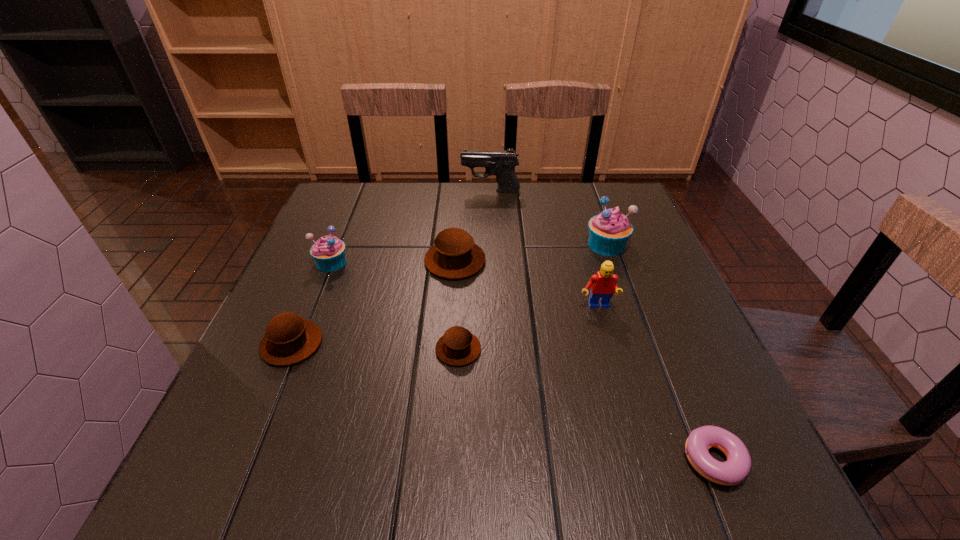
Locate which brown muffin ranks second in proximity to the third shortest object. Please provide its 2D coordinates. Your answer should be formatted as a tuple, i.e. [(x, y)], where the tuple contains the x and y coordinates of a point satisfying the conditions above.

[(458, 346)]

Where is `brown muffin that stands as the third closest to the smaller blue muffin`? Image resolution: width=960 pixels, height=540 pixels. brown muffin that stands as the third closest to the smaller blue muffin is located at coordinates (458, 346).

Find the location of `vacant space that satisfies the following two spatial constraints: 1. on the front side of the purple doughnut; 2. on the left side of the leftmost brown muffin`. vacant space that satisfies the following two spatial constraints: 1. on the front side of the purple doughnut; 2. on the left side of the leftmost brown muffin is located at coordinates (243, 461).

Locate an element on the screen. The width and height of the screenshot is (960, 540). vacant area in the image that satisfies the following two spatial constraints: 1. at the barrel of the farthest object; 2. on the back side of the bigger blue muffin is located at coordinates (492, 245).

The width and height of the screenshot is (960, 540). I want to click on vacant space that satisfies the following two spatial constraints: 1. on the back side of the biggest brown muffin; 2. on the left side of the left blue muffin, so click(332, 261).

Identify the location of vacant region that satisfies the following two spatial constraints: 1. on the front side of the right blue muffin; 2. on the right side of the doughnut. Image resolution: width=960 pixels, height=540 pixels. pyautogui.click(x=684, y=461).

At what (x,y) coordinates should I click in order to perform the action: click on free location that satisfies the following two spatial constraints: 1. on the back side of the bigger blue muffin; 2. on the left side of the left blue muffin. Please return your answer as a coordinate pair (x, y). Looking at the image, I should click on (339, 245).